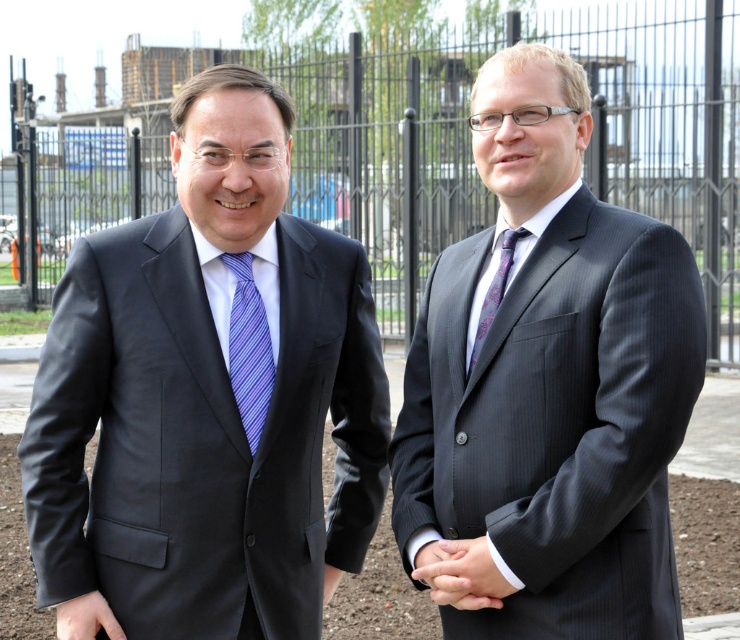
Between matte black suit at right and purple silk tie at center, which one has less height?

With less height is purple silk tie at center.

Measure the distance between matte black suit at right and purple silk tie at center.

A: matte black suit at right and purple silk tie at center are 32.11 centimeters apart.

Does point (610, 436) lie behind point (502, 272)?

No, (610, 436) is in front of (502, 272).

Where is `matte black suit at right`? matte black suit at right is located at coordinates (551, 380).

Can you confirm if black metal fence at center is bigger than purple silk tie at center?

Indeed, black metal fence at center has a larger size compared to purple silk tie at center.

Locate an element on the screen. This screenshot has height=640, width=740. black metal fence at center is located at coordinates (414, 144).

Locate an element on the screen. black metal fence at center is located at coordinates (414, 144).

Image resolution: width=740 pixels, height=640 pixels. What are the coordinates of `black metal fence at center` in the screenshot? It's located at (414, 144).

Which is in front, point (258, 356) or point (97, 621)?

Positioned in front is point (97, 621).

Locate an element on the screen. purple striped tie at left is located at coordinates (248, 348).